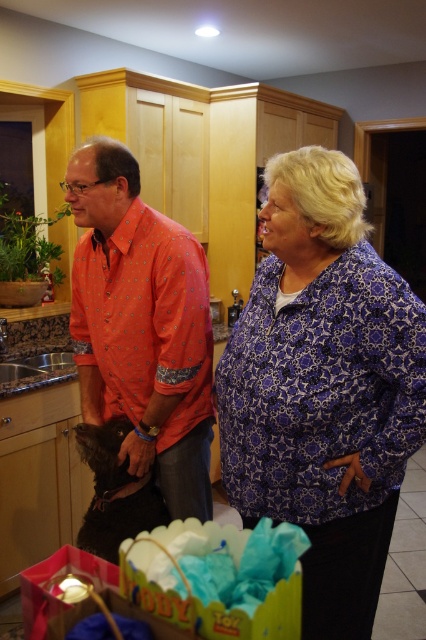
You are a fashion designer observing the scene in the image. You need to decide which clothing item to recommend for a client who prefers larger sizes. Which one between the purple printed blouse at center and the orange dotted shirt at center should you suggest?

The purple printed blouse at center is bigger than the orange dotted shirt at center, so it would be the better recommendation for a client preferring larger sizes.

You are trying to decide which clothing item to take for a casual day out. The purple printed blouse at center and orange dotted shirt at center are both options. Based on their sizes, which one is more suitable if you prefer a slimmer fit?

The purple printed blouse at center is thinner than the orange dotted shirt at center, so it would be more suitable for a slimmer fit.